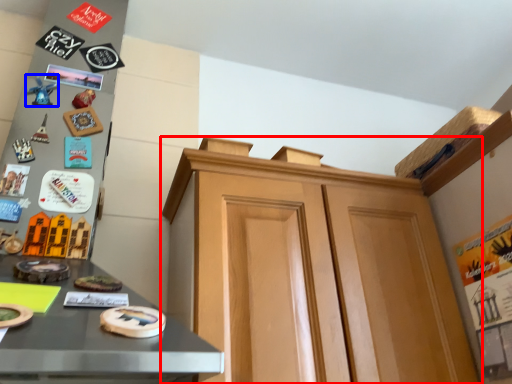
Question: Among these objects, which one is nearest to the camera, cabinetry (highlighted by a red box) or toy (highlighted by a blue box)?

Choices:
 (A) cabinetry
 (B) toy

Answer: (A)